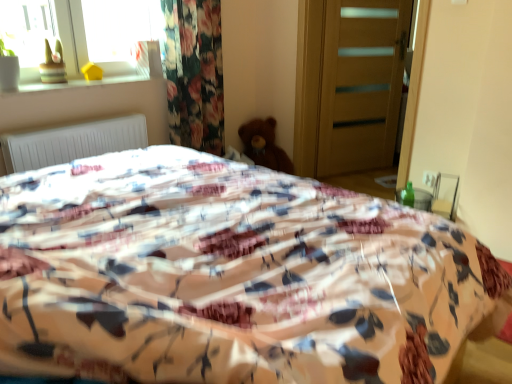
Question: From the image's perspective, is brown plush teddy bear at center over wooden door at center?

Choices:
 (A) no
 (B) yes

Answer: (A)

Question: Is brown plush teddy bear at center positioned far away from wooden door at center?

Choices:
 (A) no
 (B) yes

Answer: (A)

Question: From a real-world perspective, is brown plush teddy bear at center physically below wooden door at center?

Choices:
 (A) no
 (B) yes

Answer: (B)

Question: Is brown plush teddy bear at center surrounding wooden door at center?

Choices:
 (A) no
 (B) yes

Answer: (A)

Question: Considering the relative sizes of brown plush teddy bear at center and wooden door at center in the image provided, is brown plush teddy bear at center wider than wooden door at center?

Choices:
 (A) yes
 (B) no

Answer: (A)

Question: From a real-world perspective, is brown plush teddy bear at center above or below wooden toy at upper left?

Choices:
 (A) above
 (B) below

Answer: (B)

Question: Is brown plush teddy bear at center to the left or to the right of wooden toy at upper left in the image?

Choices:
 (A) right
 (B) left

Answer: (A)

Question: Considering their positions, is brown plush teddy bear at center located in front of or behind wooden toy at upper left?

Choices:
 (A) behind
 (B) front

Answer: (A)

Question: Is brown plush teddy bear at center taller or shorter than wooden toy at upper left?

Choices:
 (A) short
 (B) tall

Answer: (B)

Question: Visually, is wooden door at center positioned to the left or to the right of floral fabric bed at center?

Choices:
 (A) left
 (B) right

Answer: (B)

Question: Based on their sizes in the image, would you say wooden door at center is bigger or smaller than floral fabric bed at center?

Choices:
 (A) small
 (B) big

Answer: (A)

Question: Relative to floral fabric bed at center, is wooden door at center in front or behind?

Choices:
 (A) behind
 (B) front

Answer: (A)

Question: From a real-world perspective, relative to floral fabric bed at center, is wooden door at center vertically above or below?

Choices:
 (A) above
 (B) below

Answer: (A)

Question: From their relative heights in the image, would you say matte yellow vase at upper left is taller or shorter than floral fabric bed at center?

Choices:
 (A) tall
 (B) short

Answer: (B)

Question: From a real-world perspective, relative to floral fabric bed at center, is matte yellow vase at upper left vertically above or below?

Choices:
 (A) below
 (B) above

Answer: (B)